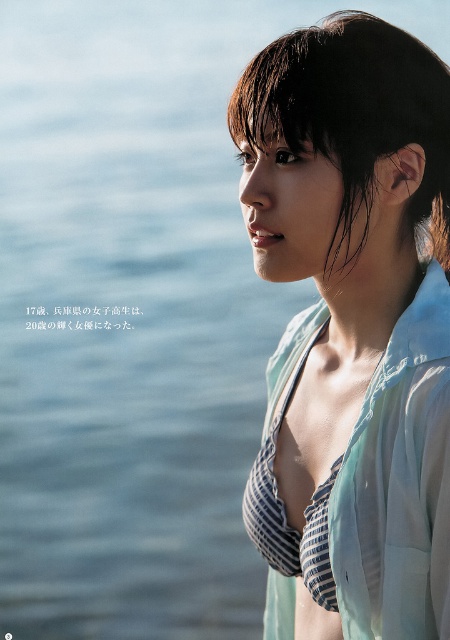
Question: Which object is positioned closest to the light blue striped bikini top at center?

Choices:
 (A) wet dark brown hair at upper center
 (B) dark brown hair at upper right

Answer: (A)

Question: Does light blue striped bikini top at center have a greater width compared to dark brown hair at upper right?

Choices:
 (A) no
 (B) yes

Answer: (B)

Question: Considering the relative positions of light blue striped bikini top at center and dark brown hair at upper right in the image provided, where is light blue striped bikini top at center located with respect to dark brown hair at upper right?

Choices:
 (A) below
 (B) above

Answer: (A)

Question: Is light blue striped bikini top at center below dark brown hair at upper right?

Choices:
 (A) yes
 (B) no

Answer: (A)

Question: Which of these objects is positioned closest to the dark brown hair at upper right?

Choices:
 (A) light blue striped bikini top at center
 (B) wet dark brown hair at upper center

Answer: (B)

Question: Which is farther from the light blue striped bikini top at center?

Choices:
 (A) dark brown hair at upper right
 (B) wet dark brown hair at upper center

Answer: (A)